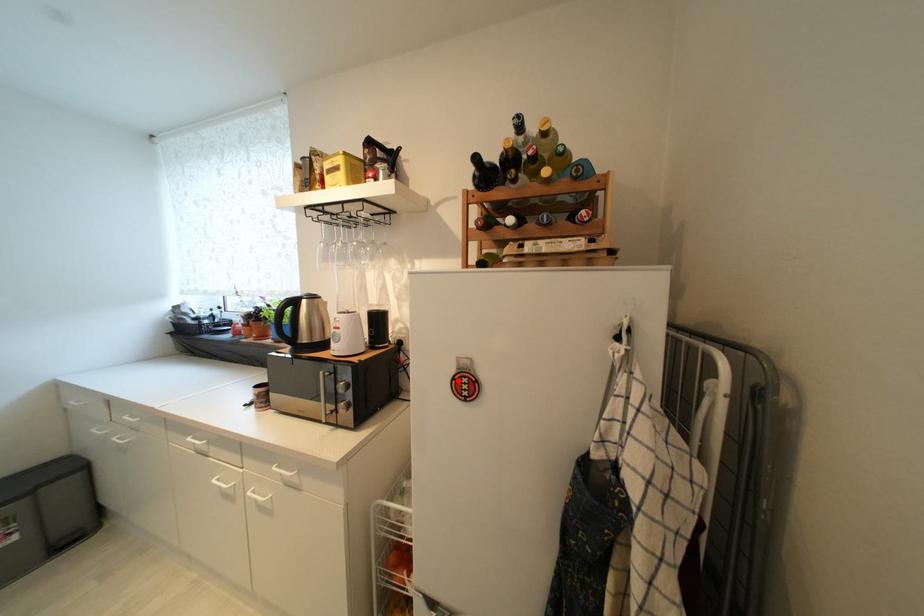
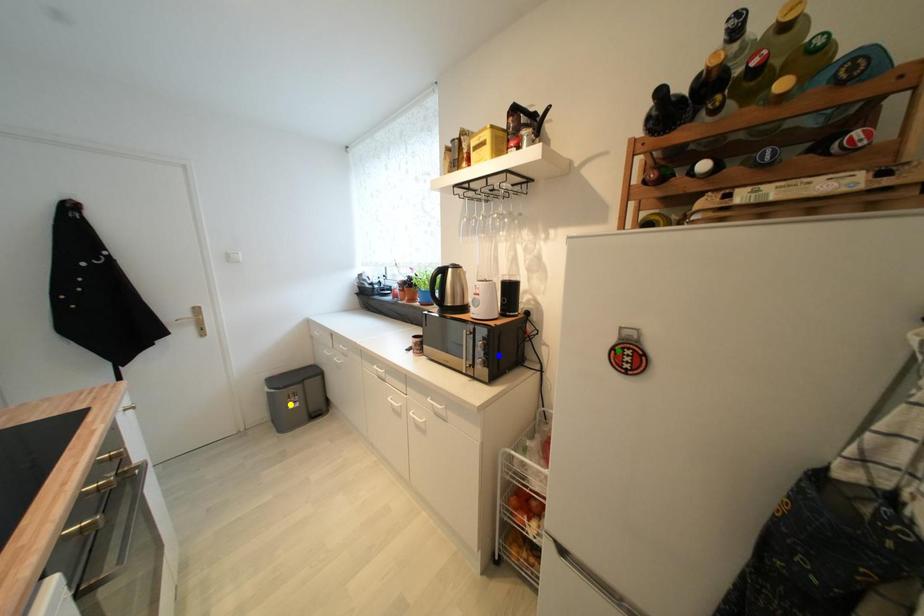
Question: I am providing you with two images of the same scene from different viewpoints. A red point is marked on the first image. You are given multiple points on the second image. In image 2, which mark is for the same physical point as the one in image 1?

Choices:
 (A) yellow point
 (B) green point
 (C) blue point

Answer: (B)